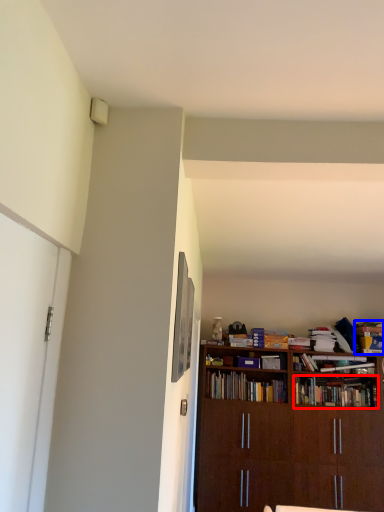
Question: Which object appears farthest to the camera in this image, book (highlighted by a red box) or book (highlighted by a blue box)?

Choices:
 (A) book
 (B) book

Answer: (B)